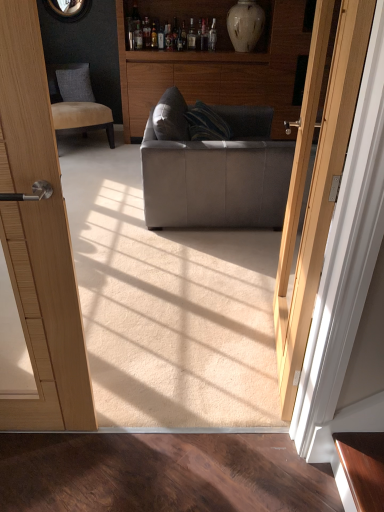
Question: In the image, is matte gray fabric couch at center on the left side or the right side of beige fabric chair at upper left?

Choices:
 (A) left
 (B) right

Answer: (B)

Question: Is matte gray fabric couch at center inside or outside of beige fabric chair at upper left?

Choices:
 (A) inside
 (B) outside

Answer: (B)

Question: Estimate the real-world distances between objects in this image. Which object is farther from the matte gray fabric couch at center?

Choices:
 (A) white glossy vase at upper center
 (B) dark gray fabric pillow at upper left
 (C) beige fabric chair at upper left
 (D) wooden cabinet at center

Answer: (B)

Question: Which object is positioned closest to the matte gray fabric couch at center?

Choices:
 (A) white glossy vase at upper center
 (B) wooden cabinet at center
 (C) beige fabric chair at upper left
 (D) dark gray fabric pillow at upper left

Answer: (B)